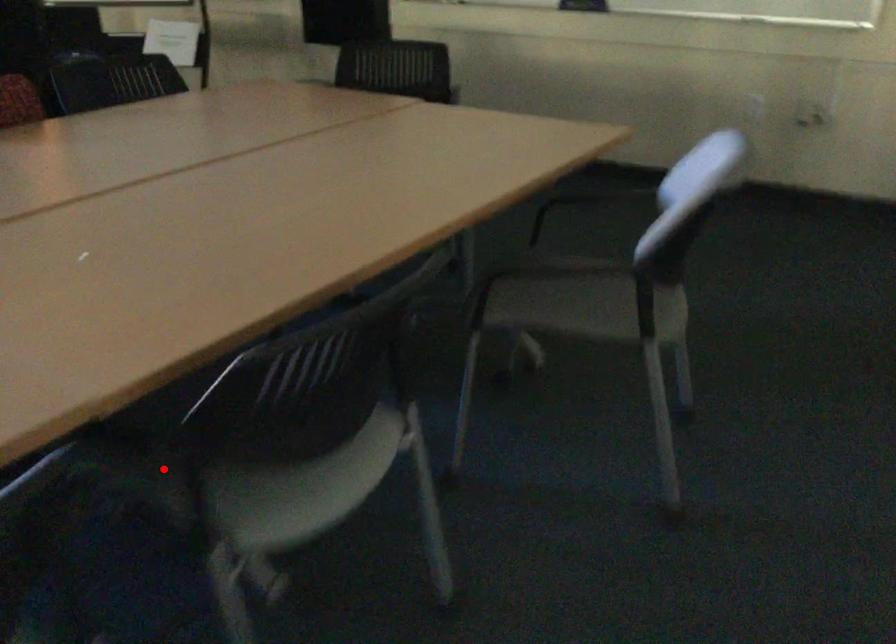
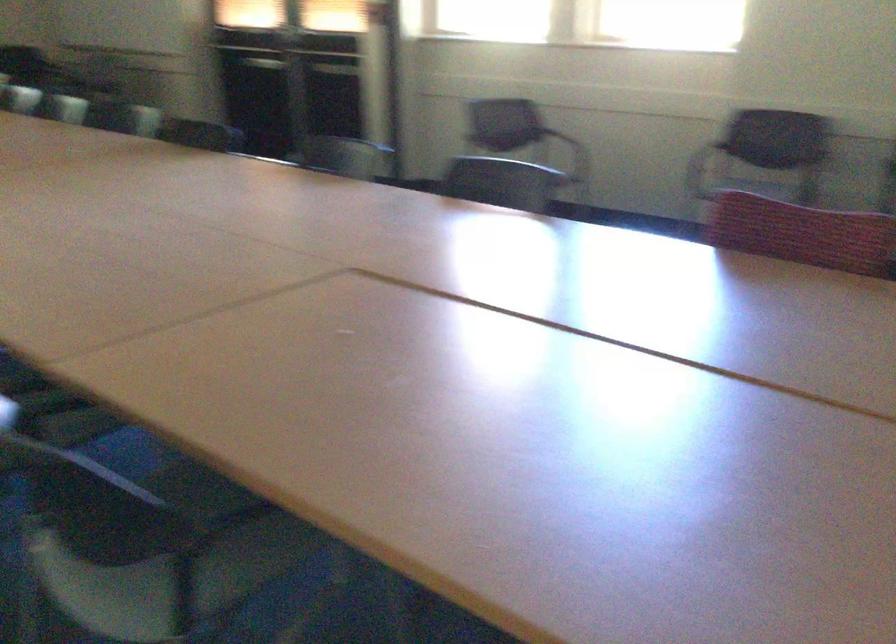
Question: I am providing you with two images of the same scene from different viewpoints. Given a red point in image1, look at the same physical point in image2. Is it:

Choices:
 (A) Closer to the viewpoint
 (B) Farther from the viewpoint

Answer: (B)